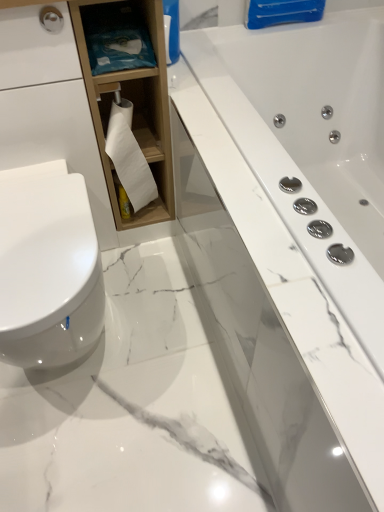
Find the location of a particular element. white marble bathtub at center is located at coordinates (299, 237).

What do you see at coordinates (129, 156) in the screenshot?
I see `white matte toilet paper at center` at bounding box center [129, 156].

Describe the element at coordinates (131, 100) in the screenshot. Image resolution: width=384 pixels, height=512 pixels. I see `wooden cabinet at left` at that location.

Locate an element on the screen. white marble bathtub at center is located at coordinates (299, 237).

Is blue fabric at upper left at the back of white glossy toilet at left?

No, white glossy toilet at left's orientation is not away from blue fabric at upper left.

In terms of size, does white glossy toilet at left appear bigger or smaller than blue fabric at upper left?

Clearly, white glossy toilet at left is larger in size than blue fabric at upper left.

How many degrees apart are the facing directions of white glossy toilet at left and blue fabric at upper left?

The facing directions of white glossy toilet at left and blue fabric at upper left are 0.4 degrees apart.

From the image's perspective, is white glossy toilet at left below blue fabric at upper left?

Yes.

From the image's perspective, does white glossy toilet at left appear lower than white matte toilet paper at center?

Yes, from the image's perspective, white glossy toilet at left is beneath white matte toilet paper at center.

Is white glossy toilet at left wider or thinner than white matte toilet paper at center?

Considering their sizes, white glossy toilet at left looks broader than white matte toilet paper at center.

Is point (79, 352) in front of point (137, 178)?

Yes.

Does white glossy toilet at left have a greater height compared to white marble bathtub at center?

In fact, white glossy toilet at left may be shorter than white marble bathtub at center.

You are a GUI agent. You are given a task and a screenshot of the screen. Output one action in this format:
    pyautogui.click(x=<x>, y=<y>)
    Task: Click on the toilet below the white marble bathtub at center (from the image's perspective)
    The image size is (384, 512).
    Given the screenshot: What is the action you would take?
    pyautogui.click(x=48, y=268)

How different are the orientations of white glossy toilet at left and white marble bathtub at center in degrees?

The angle between the facing direction of white glossy toilet at left and the facing direction of white marble bathtub at center is 90 degrees.

Does white glossy toilet at left appear on the left side of white marble bathtub at center?

Yes, white glossy toilet at left is to the left of white marble bathtub at center.

From a real-world perspective, is white marble bathtub at center on blue fabric at upper left?

Incorrect, from a real-world perspective, white marble bathtub at center is lower than blue fabric at upper left.

From the picture: Is white marble bathtub at center inside or outside of blue fabric at upper left?

The correct answer is: outside.

From their relative heights in the image, would you say white marble bathtub at center is taller or shorter than blue fabric at upper left?

In the image, white marble bathtub at center appears to be taller than blue fabric at upper left.

From a real-world perspective, is wooden cabinet at left over white matte toilet paper at center?

Yes, from a real-world perspective, wooden cabinet at left is above white matte toilet paper at center.

The width and height of the screenshot is (384, 512). In the image, there is a wooden cabinet at left. What are the coordinates of `toilet paper below it (from a real-world perspective)` in the screenshot? It's located at (129, 156).

Which object is closer to the camera taking this photo, wooden cabinet at left or white matte toilet paper at center?

Positioned in front is wooden cabinet at left.

Can you confirm if wooden cabinet at left is bigger than white glossy toilet at left?

Indeed, wooden cabinet at left has a larger size compared to white glossy toilet at left.

Is wooden cabinet at left at the left side of white glossy toilet at left?

Incorrect, wooden cabinet at left is not on the left side of white glossy toilet at left.

Based on the photo, which of these two, wooden cabinet at left or white glossy toilet at left, stands taller?

With more height is wooden cabinet at left.

Is wooden cabinet at left aimed at white glossy toilet at left?

Yes, wooden cabinet at left is turned towards white glossy toilet at left.

Does wooden cabinet at left touch blue fabric at upper left?

wooden cabinet at left is not next to blue fabric at upper left, and they're not touching.

Looking at this image, between wooden cabinet at left and blue fabric at upper left, which one has larger width?

wooden cabinet at left is wider.

Looking at this image, from the image's perspective, relative to blue fabric at upper left, is wooden cabinet at left above or below?

wooden cabinet at left is situated lower than blue fabric at upper left in the image.

Image resolution: width=384 pixels, height=512 pixels. In order to click on shelf that appears above the wooden cabinet at left (from a real-world perspective) in this screenshot , I will do `click(116, 37)`.

I want to click on shelf behind the white glossy toilet at left, so click(116, 37).

Locate an element on the screen. This screenshot has width=384, height=512. toilet paper that is above the white glossy toilet at left (from a real-world perspective) is located at coordinates (129, 156).

When comparing their distances from blue fabric at upper left, does white matte toilet paper at center or white glossy toilet at left seem closer?

white matte toilet paper at center is closer to blue fabric at upper left.

Looking at the image, which one is located further to white marble bathtub at center, white matte toilet paper at center or wooden cabinet at left?

Among the two, white matte toilet paper at center is located further to white marble bathtub at center.

Which object lies nearer to the anchor point blue fabric at upper left, wooden cabinet at left or white matte toilet paper at center?

The object closer to blue fabric at upper left is wooden cabinet at left.

Which object lies nearer to the anchor point white glossy toilet at left, blue fabric at upper left or white marble bathtub at center?

blue fabric at upper left.

From the image, which object appears to be farther from white matte toilet paper at center, blue fabric at upper left or white marble bathtub at center?

white marble bathtub at center is further to white matte toilet paper at center.

Based on their spatial positions, is white matte toilet paper at center or white glossy toilet at left closer to wooden cabinet at left?

white matte toilet paper at center lies closer to wooden cabinet at left than the other object.

Which object lies nearer to the anchor point wooden cabinet at left, white matte toilet paper at center or blue fabric at upper left?

white matte toilet paper at center.

Based on their spatial positions, is white marble bathtub at center or blue fabric at upper left further from wooden cabinet at left?

white marble bathtub at center lies further to wooden cabinet at left than the other object.

This screenshot has height=512, width=384. I want to click on bathroom cabinet between white glossy toilet at left and white marble bathtub at center, so click(131, 100).

Where is `toilet paper between blue fabric at upper left and white glossy toilet at left vertically`? The image size is (384, 512). toilet paper between blue fabric at upper left and white glossy toilet at left vertically is located at coordinates (129, 156).

The image size is (384, 512). Find the location of `toilet paper between blue fabric at upper left and white marble bathtub at center in the horizontal direction`. toilet paper between blue fabric at upper left and white marble bathtub at center in the horizontal direction is located at coordinates (129, 156).

In order to click on shelf positioned between wooden cabinet at left and white matte toilet paper at center from near to far in this screenshot , I will do `click(116, 37)`.